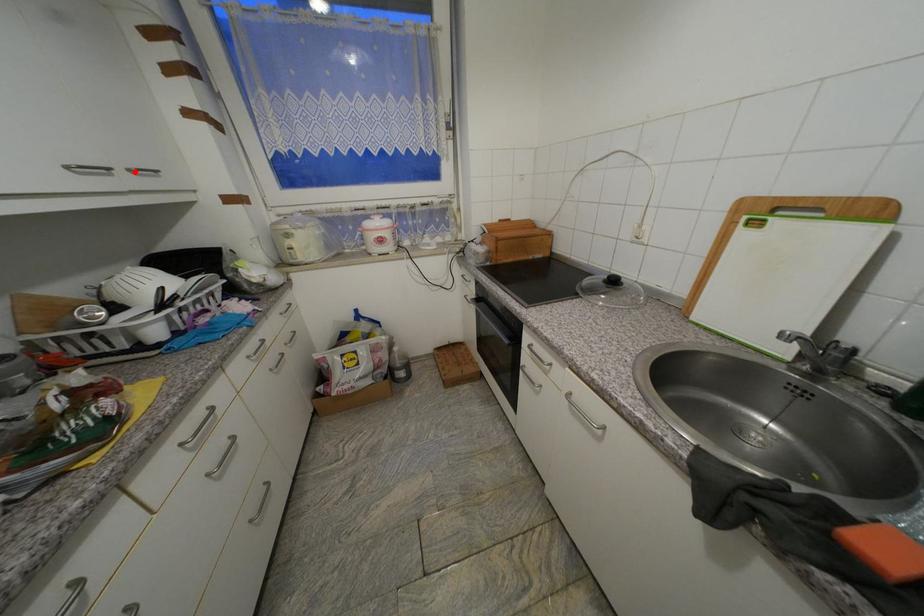
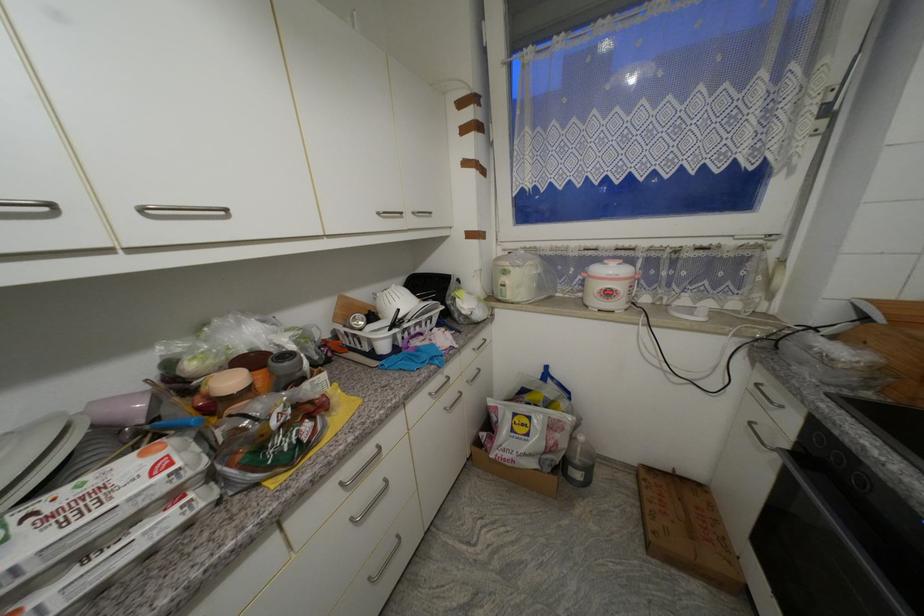
Question: I am providing you with two images of the same scene from different viewpoints. Given a red point in image1, look at the same physical point in image2. Is it:

Choices:
 (A) Closer to the viewpoint
 (B) Farther from the viewpoint

Answer: (A)